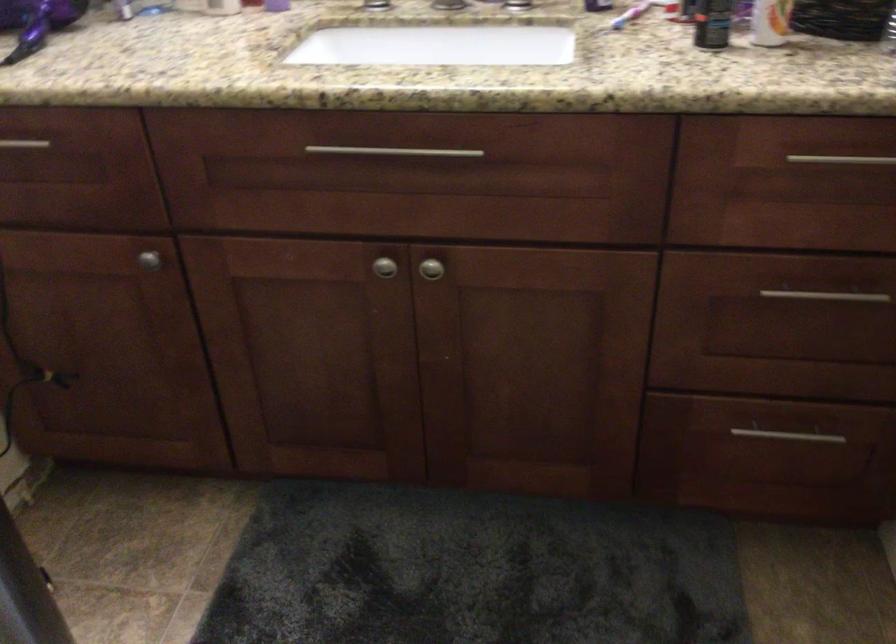
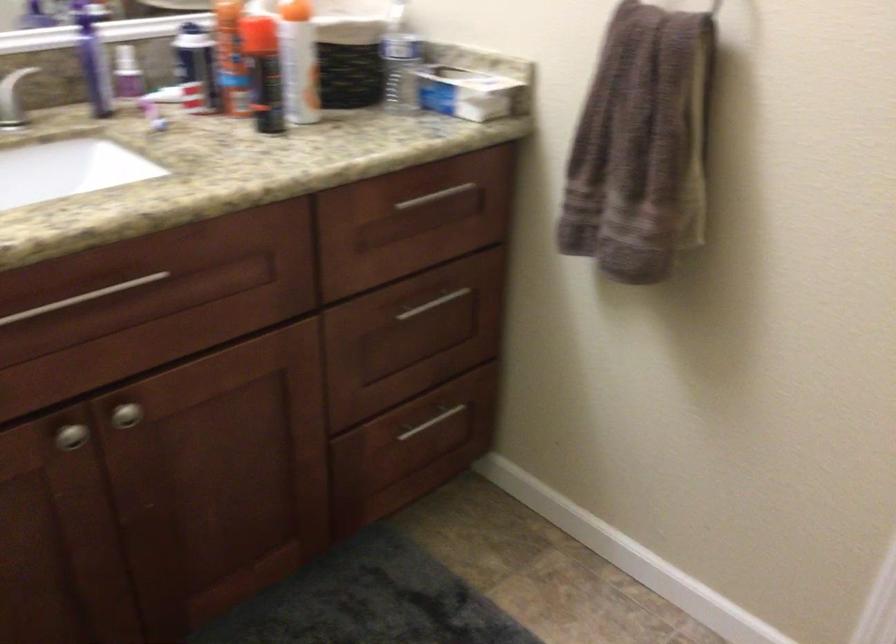
Find the pixel in the second image that matches [407,153] in the first image.

(82, 298)